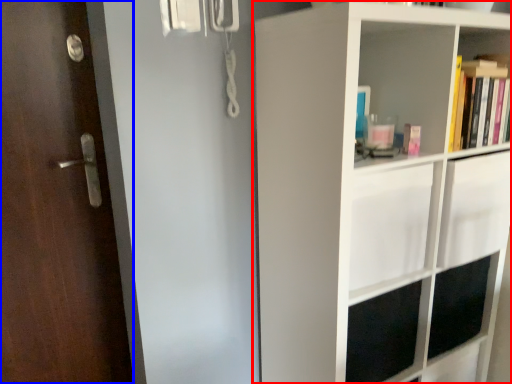
Question: Which object appears farthest to the camera in this image, shelf (highlighted by a red box) or door (highlighted by a blue box)?

Choices:
 (A) shelf
 (B) door

Answer: (B)